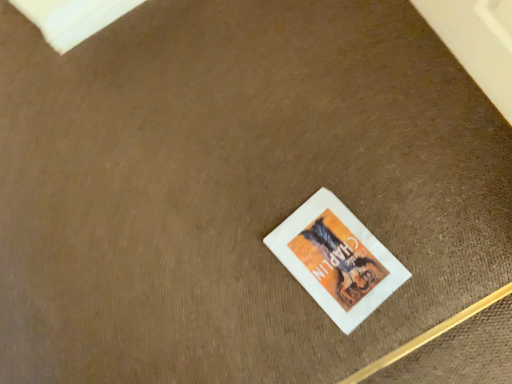
The image size is (512, 384). Describe the element at coordinates (336, 259) in the screenshot. I see `white paper book at center` at that location.

Measure the distance between white paper book at center and camera.

They are 3.31 feet apart.

I want to click on white paper book at center, so click(x=336, y=259).

Where is `white paper book at center`? Image resolution: width=512 pixels, height=384 pixels. white paper book at center is located at coordinates (336, 259).